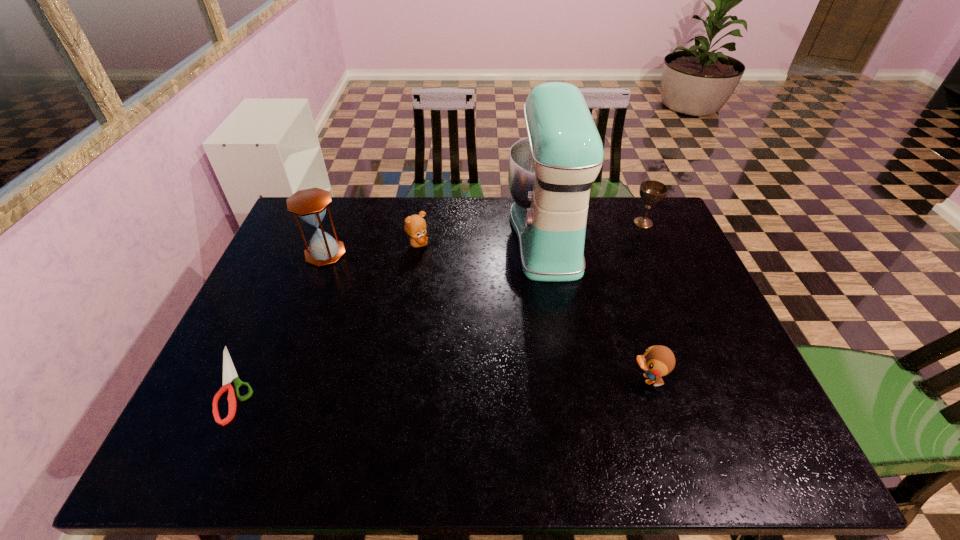
At what (x,y) coordinates should I click in order to perform the action: click on the tallest object. Please return your answer as a coordinate pair (x, y). The image size is (960, 540). Looking at the image, I should click on (551, 171).

Find the location of a particular element. The image size is (960, 540). mixer is located at coordinates (551, 171).

The image size is (960, 540). Find the location of `hourglass`. hourglass is located at coordinates (310, 205).

The image size is (960, 540). Identify the location of chalice. (651, 191).

You are a GUI agent. You are given a task and a screenshot of the screen. Output one action in this format:
    pyautogui.click(x=<x>, y=<y>)
    Task: Click on the rightmost object
    
    Given the screenshot: What is the action you would take?
    pyautogui.click(x=651, y=191)

You are a GUI agent. You are given a task and a screenshot of the screen. Output one action in this format:
    pyautogui.click(x=<x>, y=<y>)
    Task: Click on the fourth object from right to left
    
    Given the screenshot: What is the action you would take?
    pyautogui.click(x=415, y=226)

The image size is (960, 540). I want to click on duck, so coord(657,361).

Image resolution: width=960 pixels, height=540 pixels. I want to click on the shortest object, so click(229, 373).

I want to click on vacant space located 0.380m at the base of the tallest object, so click(390, 235).

Find the location of a particular element. vacant space located 0.070m at the base of the tallest object is located at coordinates (486, 235).